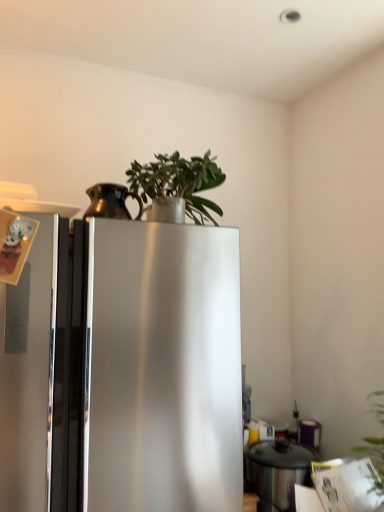
Question: Considering the positions of stainless steel pot at lower right, the first appliance in the bottom-to-top sequence, and green matte plant at upper center in the image, is stainless steel pot at lower right, the first appliance in the bottom-to-top sequence, wider or thinner than green matte plant at upper center?

Choices:
 (A) wide
 (B) thin

Answer: (B)

Question: Is stainless steel pot at lower right, positioned as the second appliance in top-to-bottom order, in front of or behind green matte plant at upper center in the image?

Choices:
 (A) behind
 (B) front

Answer: (A)

Question: Based on their relative distances, which object is farther from the satin silver refrigerator at center?

Choices:
 (A) bronze metallic pitcher at upper left, acting as the second appliance starting from the bottom
 (B) stainless steel pot at lower right, the 1th appliance from the right
 (C) green matte plant at upper center

Answer: (B)

Question: Estimate the real-world distances between objects in this image. Which object is farther from the stainless steel pot at lower right, the second appliance in the front-to-back sequence?

Choices:
 (A) bronze metallic pitcher at upper left, marked as the first appliance in a left-to-right arrangement
 (B) satin silver refrigerator at center
 (C) green matte plant at upper center

Answer: (A)